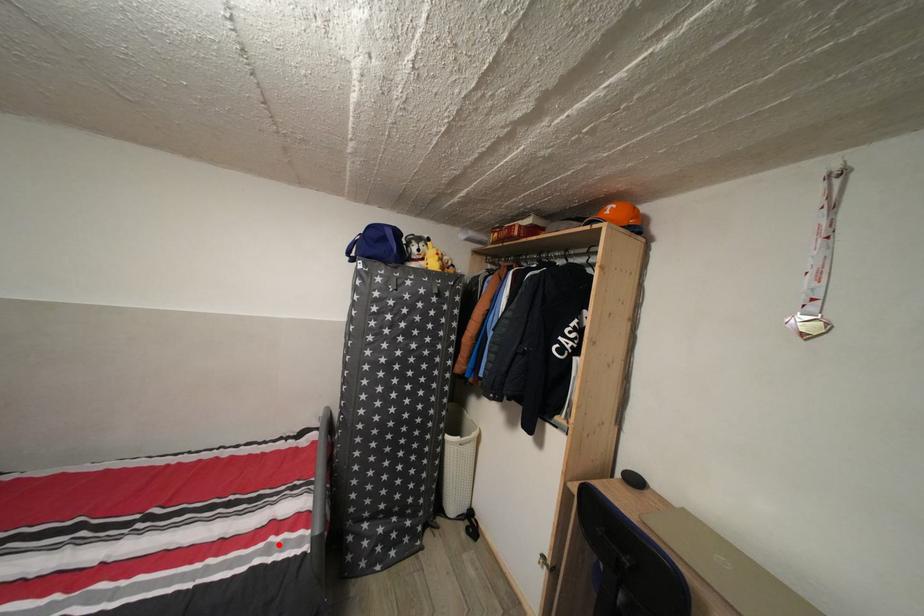
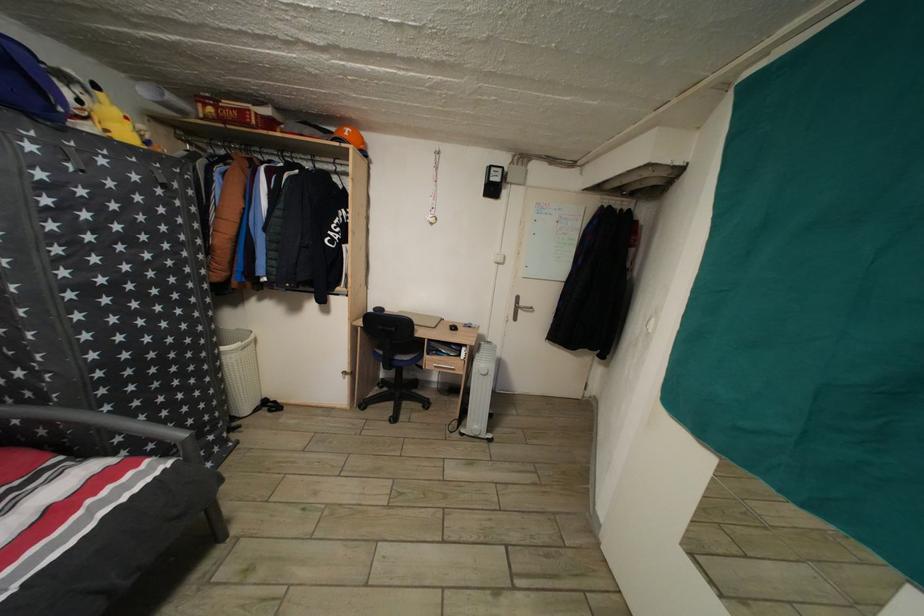
Where in the second image is the point corresponding to the highlighted location from the first image?

(96, 508)